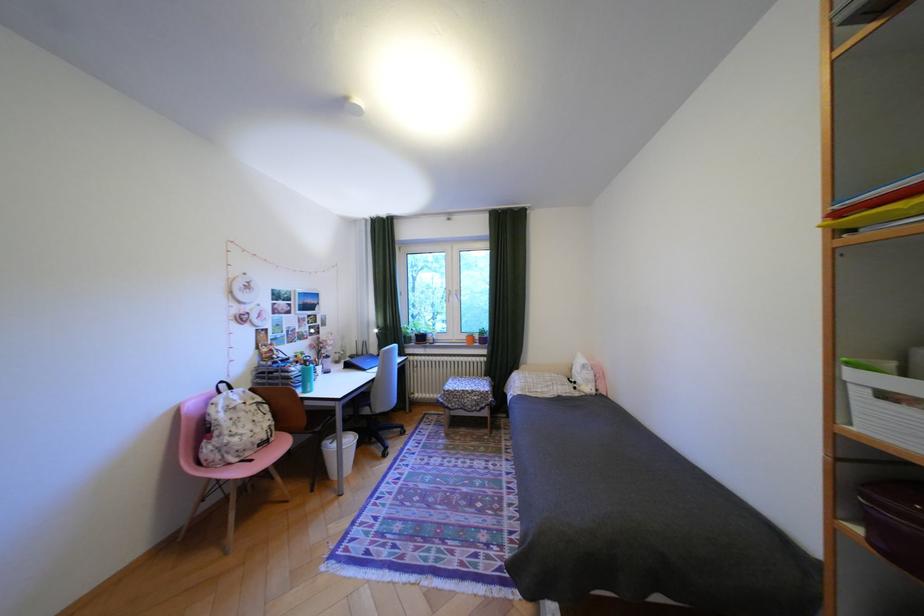
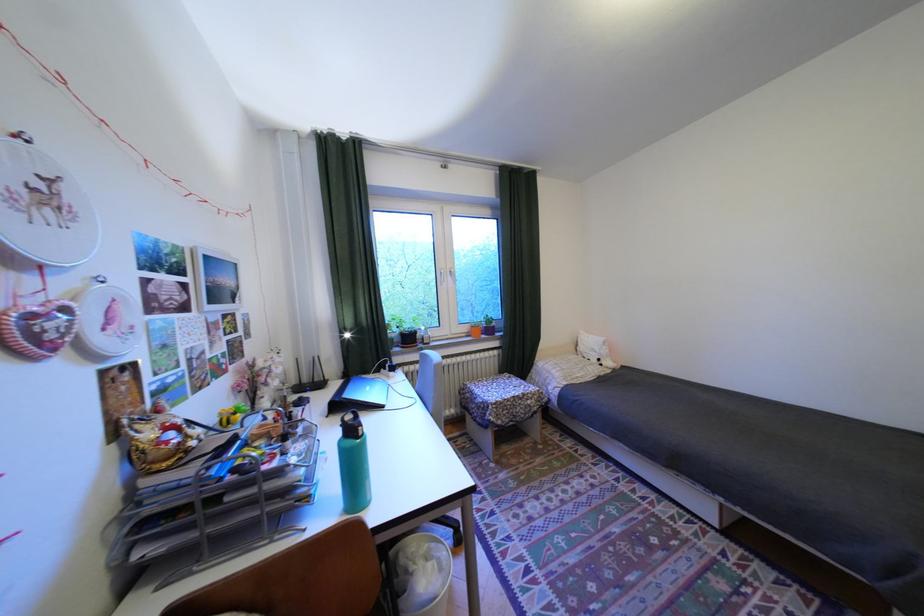
The point at (462, 406) is marked in the first image. Where is the corresponding point in the second image?

(512, 422)